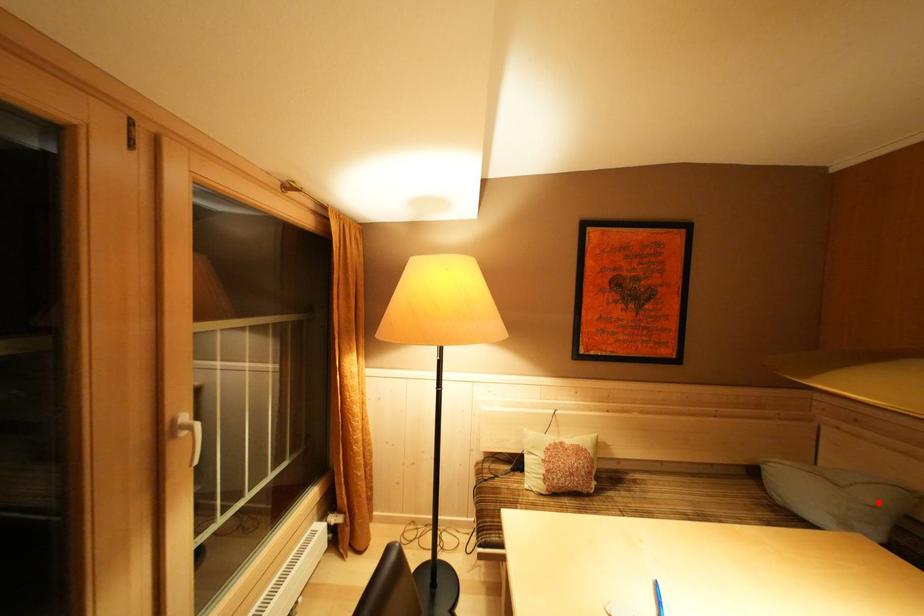
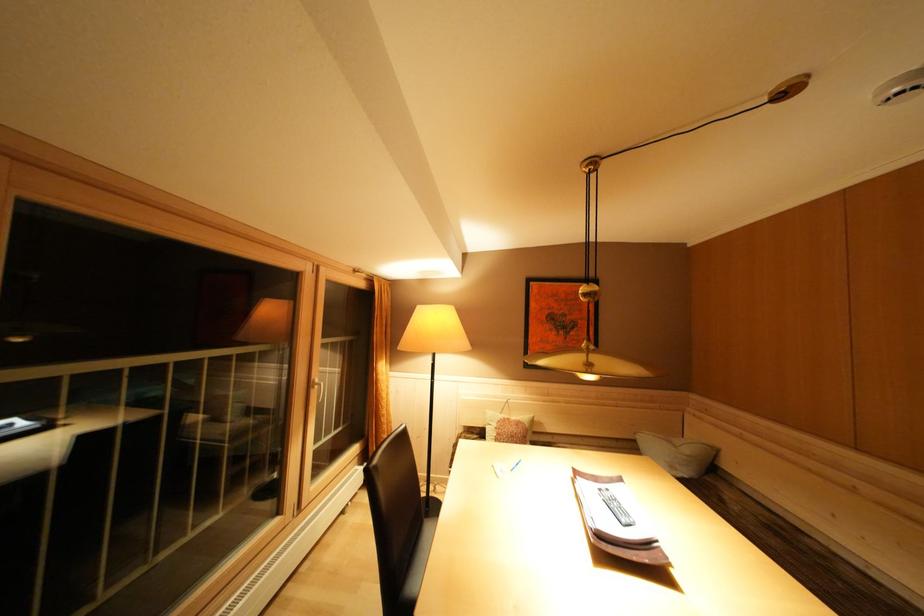
The point at the highlighted location is marked in the first image. Where is the corresponding point in the second image?

(695, 456)